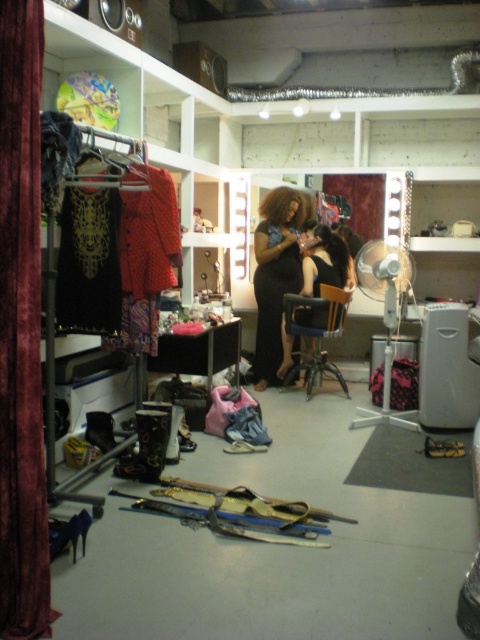
Can you confirm if metallic silver stool at center is positioned below black matte hair at center?

Yes, metallic silver stool at center is below black matte hair at center.

Does metallic silver stool at center appear over black matte hair at center?

No.

Image resolution: width=480 pixels, height=640 pixels. Find the location of `metallic silver stool at center`. metallic silver stool at center is located at coordinates (316, 336).

Locate an element on the screen. Image resolution: width=480 pixels, height=640 pixels. metallic silver stool at center is located at coordinates (316, 336).

Between black lace dress at left and black leather chair at center, which one has less height?

With less height is black leather chair at center.

Does black lace dress at left appear on the right side of black leather chair at center?

Incorrect, black lace dress at left is not on the right side of black leather chair at center.

The image size is (480, 640). What are the coordinates of `black lace dress at left` in the screenshot? It's located at pos(88,262).

Is velvet curtain at left closer to camera compared to black lace dress at left?

Yes, it is.

Is velvet curtain at left shorter than black lace dress at left?

No.

This screenshot has width=480, height=640. I want to click on velvet curtain at left, so click(21, 330).

This screenshot has width=480, height=640. Find the location of `velvet curtain at left`. velvet curtain at left is located at coordinates (21, 330).